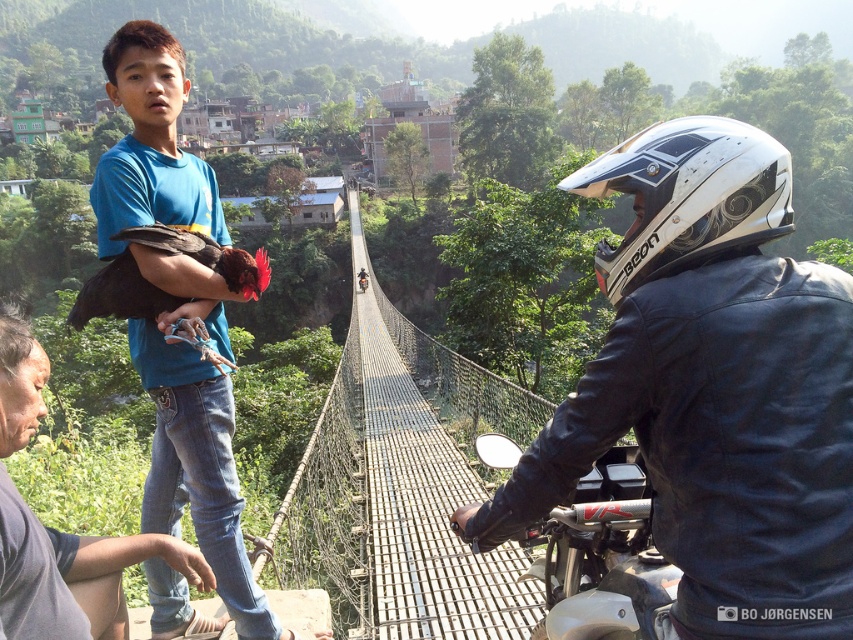
You are standing on the suspension bridge and notice a blue cotton shirt at upper left. Can you determine its exact location based on the bridge coordinates?

The blue cotton shirt at upper left is located at point (196, 438) on the bridge coordinates.

You are a photographer standing on the suspension bridge. You want to take a photo of the blue cotton shirt at upper left and the white matte motorcycle at center. Which object should you focus on first if you want to capture both in the same frame without moving the camera?

The blue cotton shirt at upper left is taller than the white matte motorcycle at center, so you should focus on the blue cotton shirt at upper left first to ensure both are in the frame.

You are a photographer standing on the suspension bridge. You want to take a photo of the white glossy helmet at upper right and the white matte motorcycle at center. Which object should you zoom in on to capture more details without moving your camera, considering their sizes in the frame?

The white glossy helmet at upper right is wider than the white matte motorcycle at center, so you should zoom in on the white glossy helmet at upper right to capture more details since it occupies a larger portion of the frame.